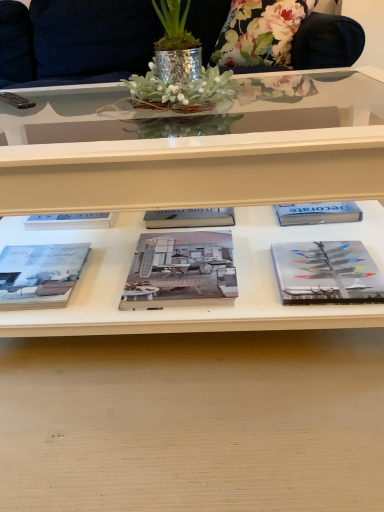
Question: Does matte gray book at lower left, marked as the third book in a right-to-left arrangement, touch gray matte book at right, acting as the 1th book starting from the right?

Choices:
 (A) no
 (B) yes

Answer: (A)

Question: From a real-world perspective, is matte gray book at lower left, marked as the third book in a right-to-left arrangement, below gray matte book at right, which is the 3th book from left to right?

Choices:
 (A) yes
 (B) no

Answer: (B)

Question: Is matte gray book at lower left, which is the 1th book in left-to-right order, facing away from gray matte book at right, which is the 3th book from left to right?

Choices:
 (A) yes
 (B) no

Answer: (B)

Question: Is matte gray book at lower left, marked as the third book in a right-to-left arrangement, wider than gray matte book at right, acting as the 1th book starting from the right?

Choices:
 (A) yes
 (B) no

Answer: (A)

Question: Is matte gray book at lower left, which is the 1th book in left-to-right order, outside of gray matte book at right, acting as the 1th book starting from the right?

Choices:
 (A) yes
 (B) no

Answer: (A)

Question: Is matte gray book at lower left, which is the 1th book in left-to-right order, surrounding gray matte book at right, which is the 3th book from left to right?

Choices:
 (A) no
 (B) yes

Answer: (A)

Question: Is matte gray book at center, which is counted as the second book, starting from the left, at the right side of matte gray book at lower left, marked as the third book in a right-to-left arrangement?

Choices:
 (A) yes
 (B) no

Answer: (A)

Question: Is matte gray book at lower left, marked as the third book in a right-to-left arrangement, completely or partially inside matte gray book at center, positioned as the second book in right-to-left order?

Choices:
 (A) no
 (B) yes

Answer: (A)

Question: Is matte gray book at center, which is counted as the second book, starting from the left, positioned before matte gray book at lower left, marked as the third book in a right-to-left arrangement?

Choices:
 (A) no
 (B) yes

Answer: (B)

Question: Can you confirm if matte gray book at center, positioned as the second book in right-to-left order, is taller than matte gray book at lower left, marked as the third book in a right-to-left arrangement?

Choices:
 (A) no
 (B) yes

Answer: (A)

Question: Considering the relative sizes of matte gray book at center, which is counted as the second book, starting from the left, and matte gray book at lower left, marked as the third book in a right-to-left arrangement, in the image provided, is matte gray book at center, which is counted as the second book, starting from the left, wider than matte gray book at lower left, marked as the third book in a right-to-left arrangement,?

Choices:
 (A) yes
 (B) no

Answer: (A)

Question: Is matte gray book at center, which is counted as the second book, starting from the left, with matte gray book at lower left, which is the 1th book in left-to-right order?

Choices:
 (A) no
 (B) yes

Answer: (A)

Question: Does gray matte book at right, which is the 3th book from left to right, have a lesser height compared to matte gray book at lower left, marked as the third book in a right-to-left arrangement?

Choices:
 (A) no
 (B) yes

Answer: (B)